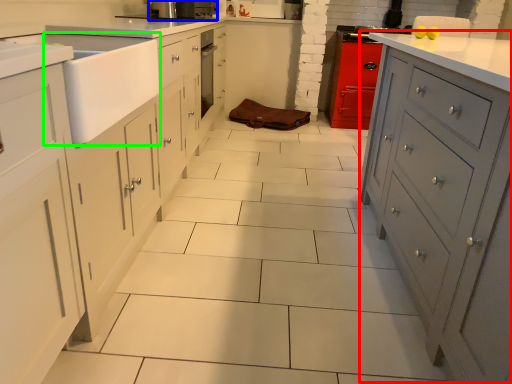
Question: Estimate the real-world distances between objects in this image. Which object is farther from file cabinet (highlighted by a red box), home appliance (highlighted by a blue box) or sink (highlighted by a green box)?

Choices:
 (A) home appliance
 (B) sink

Answer: (A)